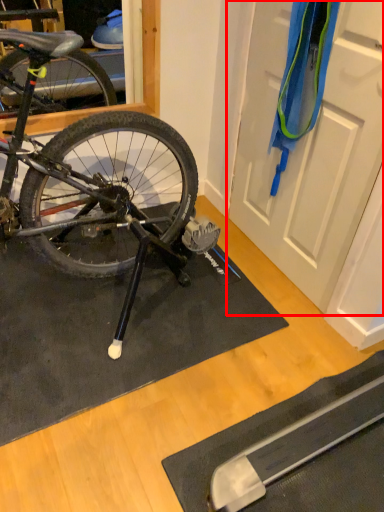
Question: From the image's perspective, what is the correct spatial positioning of door (annotated by the red box) in reference to doormat?

Choices:
 (A) above
 (B) below

Answer: (A)